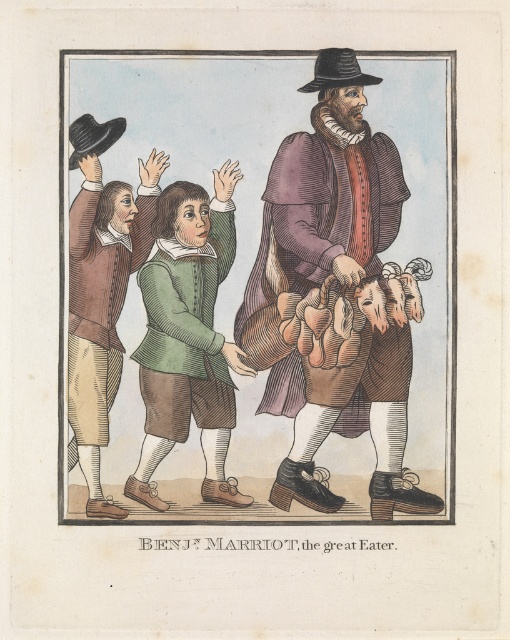
Question: Which point is farther from the camera taking this photo?

Choices:
 (A) [x=191, y=397]
 (B) [x=139, y=232]

Answer: (B)

Question: Which point appears farthest from the camera in this image?

Choices:
 (A) pyautogui.click(x=78, y=209)
 (B) pyautogui.click(x=209, y=349)
 (C) pyautogui.click(x=378, y=348)

Answer: (A)

Question: Does green velvet vest at center come behind matte brown vest at left?

Choices:
 (A) no
 (B) yes

Answer: (A)

Question: Does brown leather coat at center appear under matte brown vest at left?

Choices:
 (A) no
 (B) yes

Answer: (A)

Question: Which point is farther to the camera?

Choices:
 (A) matte brown vest at left
 (B) brown leather coat at center
 (C) green velvet vest at center

Answer: (A)

Question: Considering the relative positions of brown leather coat at center and matte brown vest at left in the image provided, where is brown leather coat at center located with respect to matte brown vest at left?

Choices:
 (A) left
 (B) right

Answer: (B)